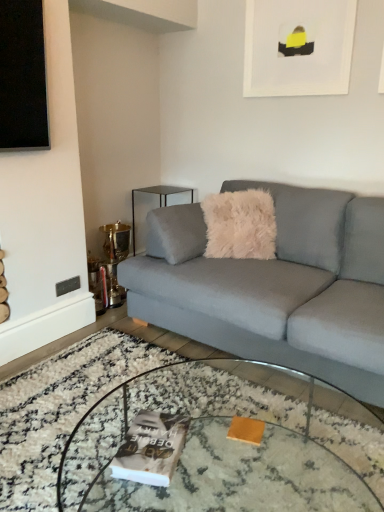
Question: Is clear glass coffee table at center surrounded by light gray fabric couch at center?

Choices:
 (A) yes
 (B) no

Answer: (B)

Question: Considering the relative positions of light gray fabric couch at center and clear glass coffee table at center in the image provided, is light gray fabric couch at center to the right of clear glass coffee table at center from the viewer's perspective?

Choices:
 (A) no
 (B) yes

Answer: (B)

Question: Can you confirm if light gray fabric couch at center is shorter than clear glass coffee table at center?

Choices:
 (A) yes
 (B) no

Answer: (B)

Question: Is light gray fabric couch at center with clear glass coffee table at center?

Choices:
 (A) no
 (B) yes

Answer: (A)

Question: Is light gray fabric couch at center positioned with its back to clear glass coffee table at center?

Choices:
 (A) no
 (B) yes

Answer: (A)

Question: Considering the positions of matte gray magazine at center and white matte picture frame at upper center in the image, is matte gray magazine at center wider or thinner than white matte picture frame at upper center?

Choices:
 (A) thin
 (B) wide

Answer: (B)

Question: From the image's perspective, relative to white matte picture frame at upper center, is matte gray magazine at center above or below?

Choices:
 (A) below
 (B) above

Answer: (A)

Question: Is matte gray magazine at center spatially inside white matte picture frame at upper center, or outside of it?

Choices:
 (A) inside
 (B) outside

Answer: (B)

Question: In the image, is matte gray magazine at center positioned in front of or behind white matte picture frame at upper center?

Choices:
 (A) front
 (B) behind

Answer: (A)

Question: Is clear glass side table at upper left wider or thinner than white matte picture frame at upper center?

Choices:
 (A) wide
 (B) thin

Answer: (A)

Question: From the image's perspective, is clear glass side table at upper left above or below white matte picture frame at upper center?

Choices:
 (A) above
 (B) below

Answer: (B)

Question: Based on their sizes in the image, would you say clear glass side table at upper left is bigger or smaller than white matte picture frame at upper center?

Choices:
 (A) big
 (B) small

Answer: (A)

Question: Is clear glass side table at upper left situated inside white matte picture frame at upper center or outside?

Choices:
 (A) inside
 (B) outside

Answer: (B)

Question: In terms of height, does clear glass coffee table at center look taller or shorter compared to white matte picture frame at upper center?

Choices:
 (A) short
 (B) tall

Answer: (A)

Question: From the image's perspective, is clear glass coffee table at center located above or below white matte picture frame at upper center?

Choices:
 (A) below
 (B) above

Answer: (A)